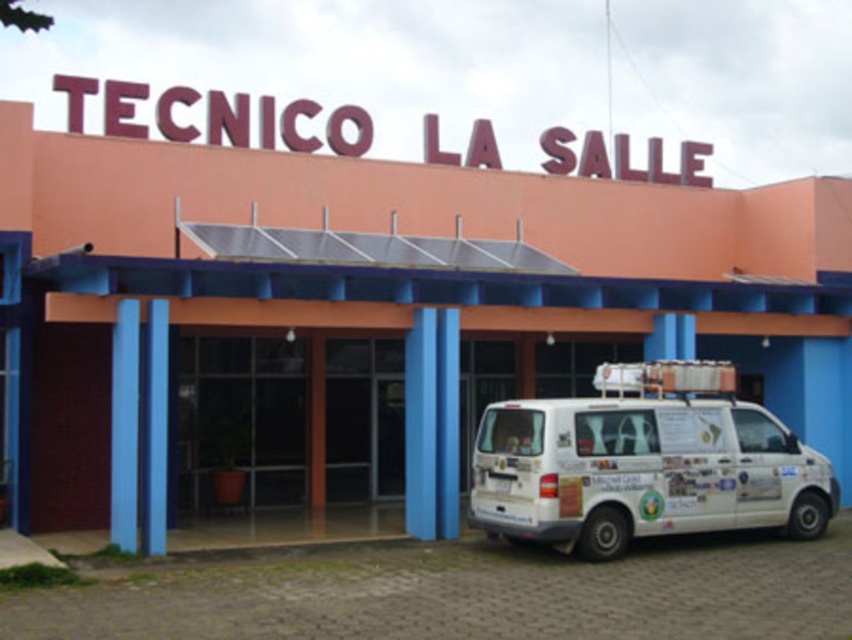
Does point (659, 253) lie in front of point (540, 490)?

No, it is behind (540, 490).

Which is behind, point (557, 182) or point (567, 442)?

Positioned behind is point (557, 182).

Identify the location of white van at center. (370, 314).